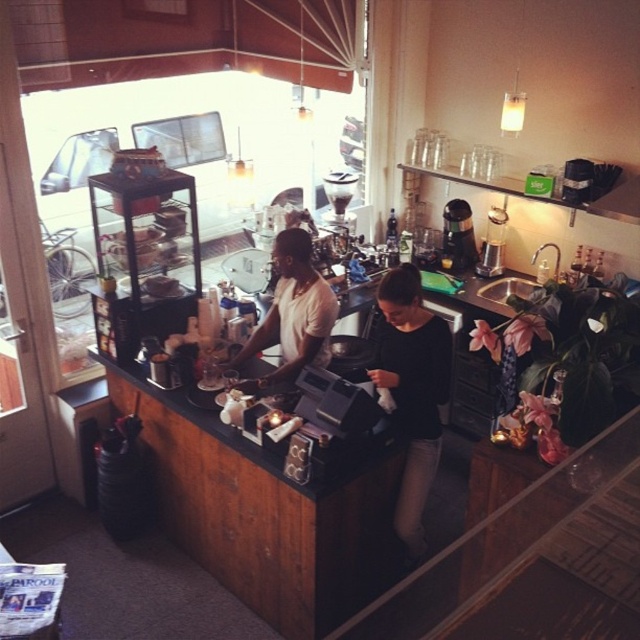
Question: Is black matte shirt at center to the right of metallic silver coffee machine at center from the viewer's perspective?

Choices:
 (A) no
 (B) yes

Answer: (A)

Question: Which of the following is the farthest from the observer?

Choices:
 (A) white matte shirt at center
 (B) metallic silver coffee machine at center

Answer: (B)

Question: Can you confirm if black matte shirt at center is wider than metallic silver coffee machine at center?

Choices:
 (A) yes
 (B) no

Answer: (A)

Question: Can you confirm if black matte shirt at center is bigger than metallic silver coffee machine at center?

Choices:
 (A) yes
 (B) no

Answer: (A)

Question: Which is nearer to the metallic silver coffee machine at center?

Choices:
 (A) white matte shirt at center
 (B) black matte shirt at center

Answer: (B)

Question: Which object is positioned closest to the white matte shirt at center?

Choices:
 (A) metallic silver coffee machine at center
 (B) black matte shirt at center

Answer: (B)